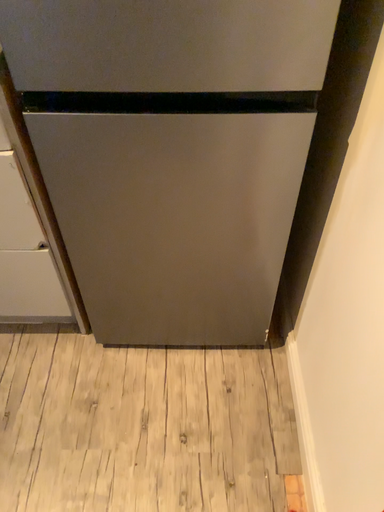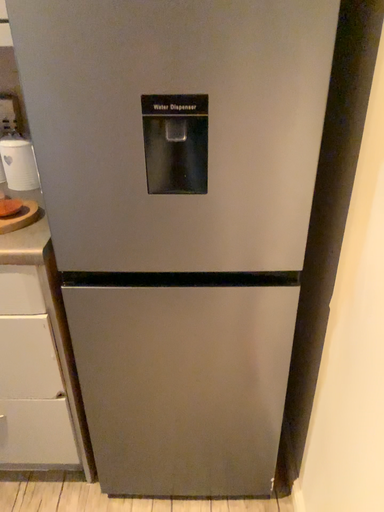
Question: Which way did the camera rotate in the video?

Choices:
 (A) rotated downward
 (B) rotated upward

Answer: (B)